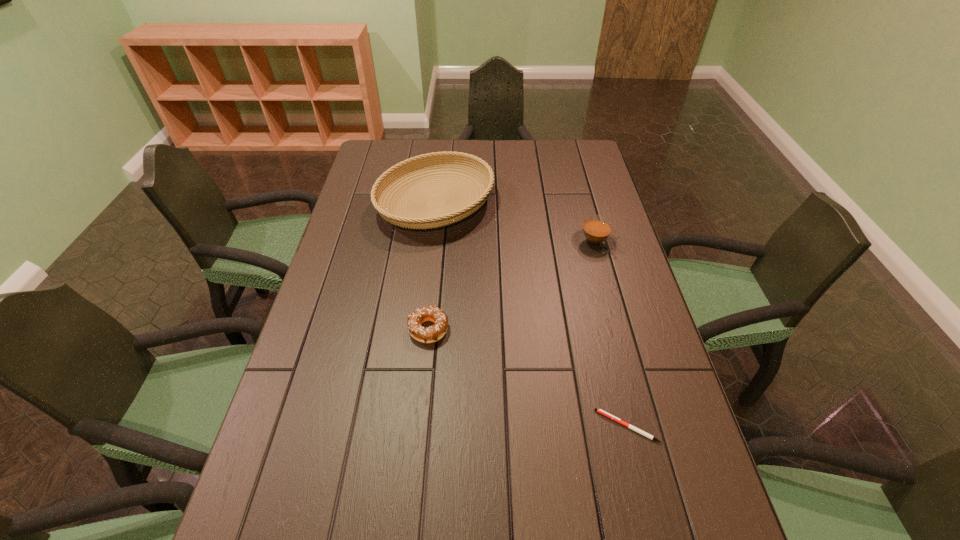
Where is `basket`? The width and height of the screenshot is (960, 540). basket is located at coordinates (421, 219).

Locate an element on the screen. Image resolution: width=960 pixels, height=540 pixels. the second tallest object is located at coordinates (595, 236).

Locate an element on the screen. doughnut is located at coordinates coord(433,333).

At what (x,y) coordinates should I click in order to perform the action: click on the third farthest object. Please return your answer as a coordinate pair (x, y). The height and width of the screenshot is (540, 960). Looking at the image, I should click on (433, 333).

Where is `the nearest object`? The image size is (960, 540). the nearest object is located at coordinates (600, 411).

Locate an element on the screen. pen is located at coordinates (600, 411).

This screenshot has width=960, height=540. Find the location of `free location located 0.110m on the back of the basket`. free location located 0.110m on the back of the basket is located at coordinates (442, 156).

What are the coordinates of `vacant space positioned 0.360m on the back of the third shortest object` in the screenshot? It's located at pyautogui.click(x=574, y=168).

Identify the location of vacant space located on the right of the doughnut. pyautogui.click(x=588, y=329).

Locate an element on the screen. The height and width of the screenshot is (540, 960). vacant space positioned 0.090m on the clicker of the nearest object is located at coordinates (557, 426).